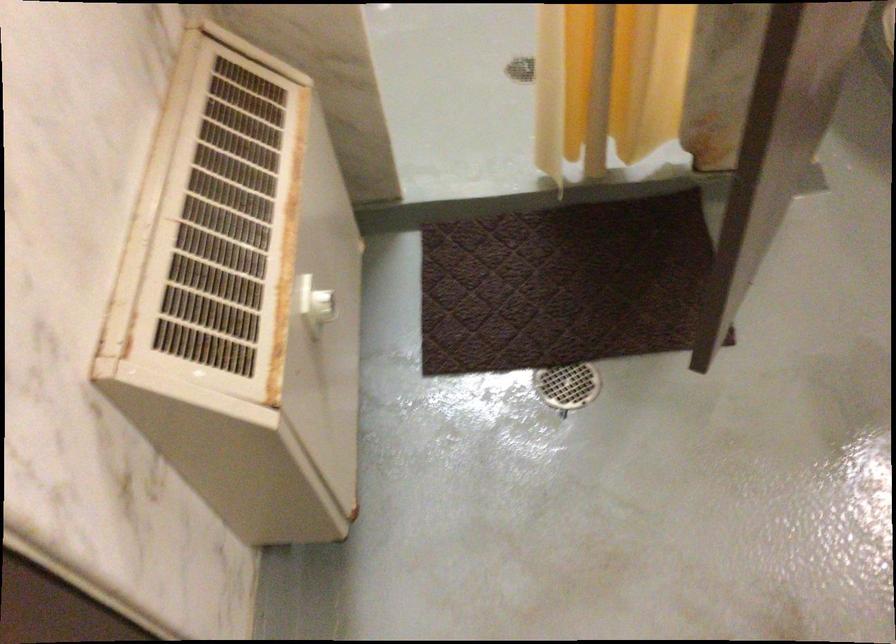
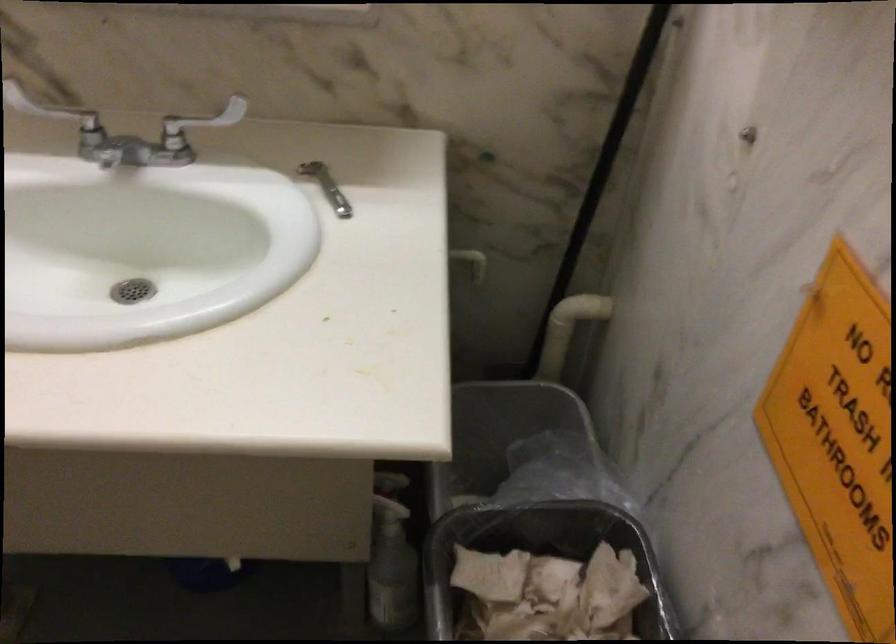
How did the camera likely rotate?

The rotation direction of the camera is right-down.